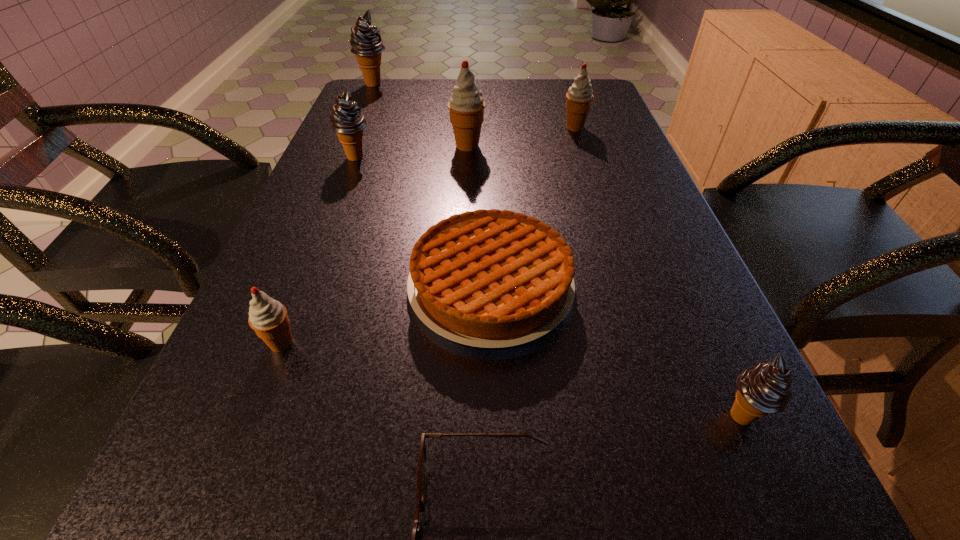
Find the location of a particular element. This screenshot has width=960, height=540. object located at the far left corner is located at coordinates (366, 42).

The image size is (960, 540). Identify the location of blank space at the far edge of the desktop. (488, 103).

You are a GUI agent. You are given a task and a screenshot of the screen. Output one action in this format:
    pyautogui.click(x=<x>, y=<y>)
    Task: Click on the free region at the left edge of the desktop
    Image resolution: width=960 pixels, height=540 pixels.
    Given the screenshot: What is the action you would take?
    pyautogui.click(x=333, y=143)

I want to click on blank space at the right edge, so click(652, 201).

This screenshot has height=540, width=960. What are the coordinates of `empty location between the second nearest red icecream and the leftmost red icecream` in the screenshot? It's located at (374, 245).

Locate an element on the screen. vacant space that's between the fifth farthest icecream and the farthest chocolate icecream is located at coordinates (327, 214).

What are the coordinates of `free area in between the nearest red icecream and the pie` in the screenshot? It's located at (386, 314).

This screenshot has height=540, width=960. In order to click on free space between the second nearest chocolate icecream and the leftmost red icecream in this screenshot , I will do `click(319, 250)`.

Where is `free space between the leftmost red icecream and the second biggest chocolate icecream`? This screenshot has width=960, height=540. free space between the leftmost red icecream and the second biggest chocolate icecream is located at coordinates (319, 250).

Locate an element on the screen. The image size is (960, 540). empty space between the farthest object and the pie is located at coordinates (432, 185).